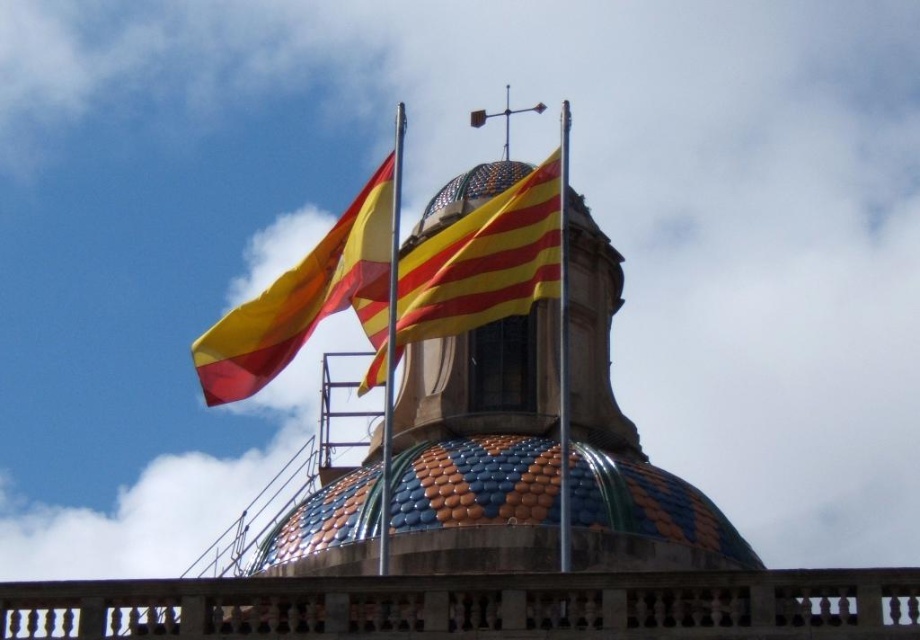
You are standing 100 meters away from the building and want to take a photo of the yellowstriped fabricflag at center. Given that the camera you have can focus up to 80 meters, will you be able to capture the flag clearly?

The yellowstriped fabricflag at center is 65.52 meters away from the camera, which is within the camera focus range of up to 80 meters. Therefore, you can capture the flag clearly.